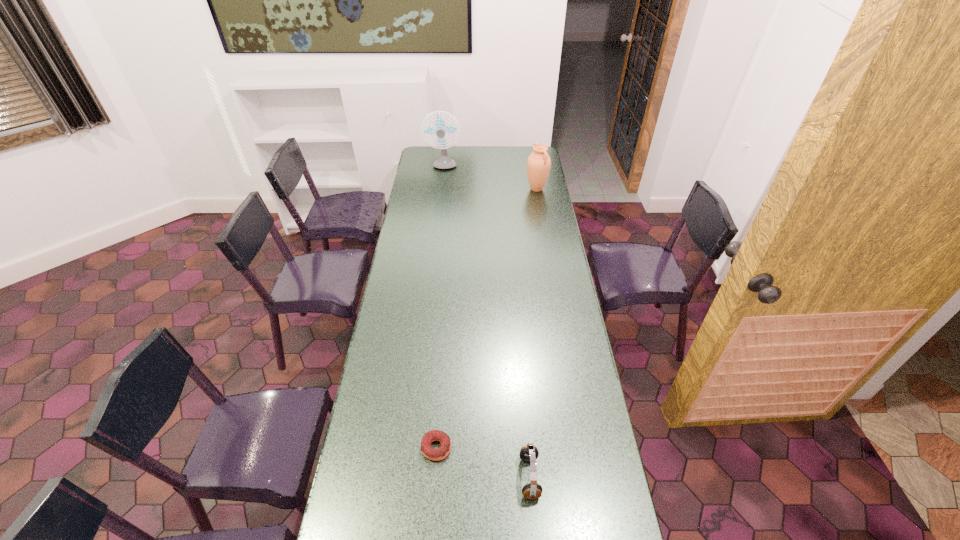
Image resolution: width=960 pixels, height=540 pixels. Identify the location of free region located on the ear cups of the headset. (475, 477).

Locate an element on the screen. The image size is (960, 540). vacant space situated on the ear cups of the headset is located at coordinates (486, 477).

Find the location of `vacant space situated on the back of the doughnut`. vacant space situated on the back of the doughnut is located at coordinates (444, 339).

The image size is (960, 540). I want to click on object located in the far edge section of the desktop, so click(444, 162).

This screenshot has height=540, width=960. I want to click on object located at the left edge, so click(x=444, y=162).

Locate an element on the screen. The width and height of the screenshot is (960, 540). object that is at the right edge is located at coordinates (538, 164).

The height and width of the screenshot is (540, 960). In order to click on object present at the far left corner in this screenshot , I will do `click(444, 162)`.

Where is `vacant region at the far edge of the desktop`? This screenshot has width=960, height=540. vacant region at the far edge of the desktop is located at coordinates (512, 151).

Image resolution: width=960 pixels, height=540 pixels. Identify the location of blank area at the left edge. (392, 438).

At what (x,y) coordinates should I click in order to perform the action: click on vacant area at the right edge. Please return your answer as a coordinate pair (x, y). The height and width of the screenshot is (540, 960). Looking at the image, I should click on (564, 279).